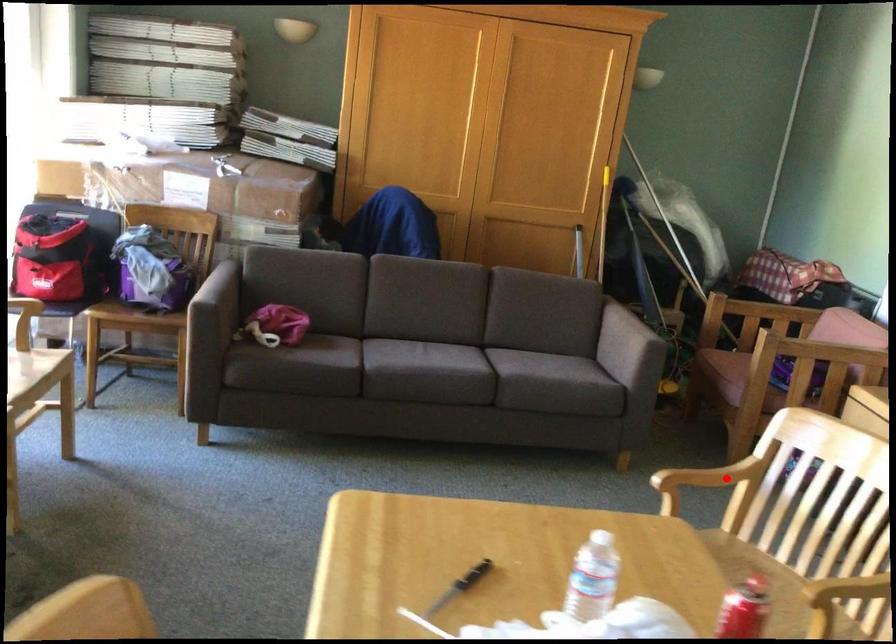
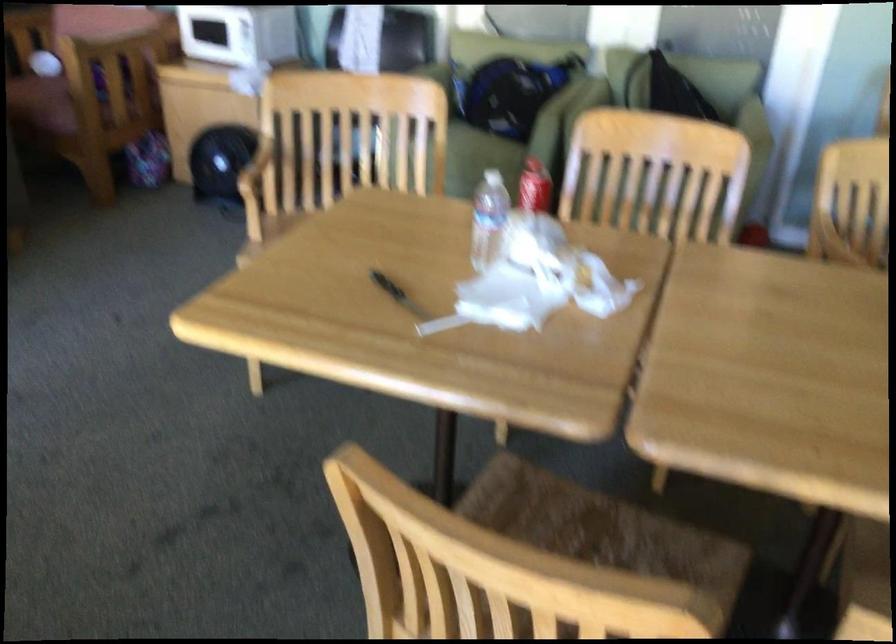
Find the pixel in the second image that matches the highlighted location in the first image.

(255, 166)